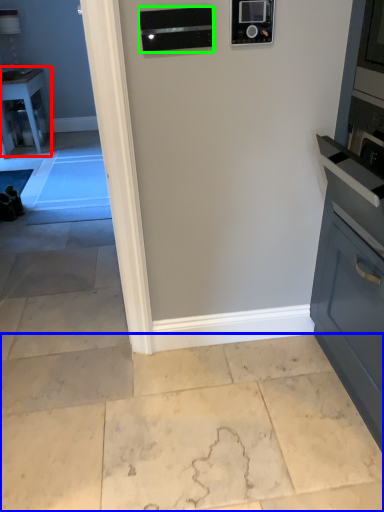
Question: Which is nearer to the table (highlighted by a red box)? concrete (highlighted by a blue box) or appliance (highlighted by a green box).

Choices:
 (A) concrete
 (B) appliance

Answer: (B)